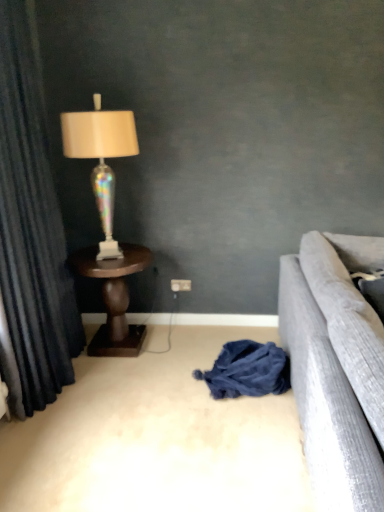
Question: From a real-world perspective, is white plastic power outlet at center physically located above or below brown wooden table at left?

Choices:
 (A) above
 (B) below

Answer: (B)

Question: Is white plastic power outlet at center inside the boundaries of brown wooden table at left, or outside?

Choices:
 (A) inside
 (B) outside

Answer: (B)

Question: Which object is the closest to the dark blue fabric at center?

Choices:
 (A) dark blue velvet curtain at left
 (B) white plastic power outlet at center
 (C) iridescent glass lamp at left
 (D) brown wooden table at left

Answer: (D)

Question: Based on their relative distances, which object is farther from the iridescent glass lamp at left?

Choices:
 (A) brown wooden table at left
 (B) white plastic power outlet at center
 (C) dark blue fabric at center
 (D) dark blue velvet curtain at left

Answer: (C)